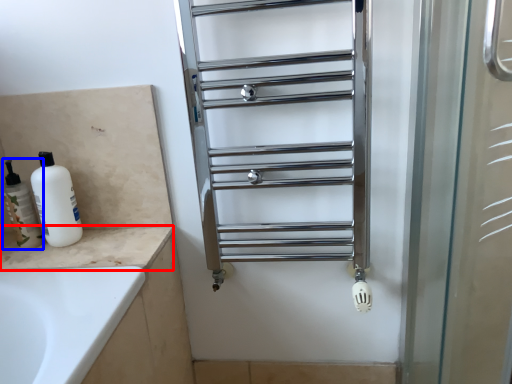
Question: Which point is further to the camera, counter top (highlighted by a red box) or toiletry (highlighted by a blue box)?

Choices:
 (A) counter top
 (B) toiletry

Answer: (B)